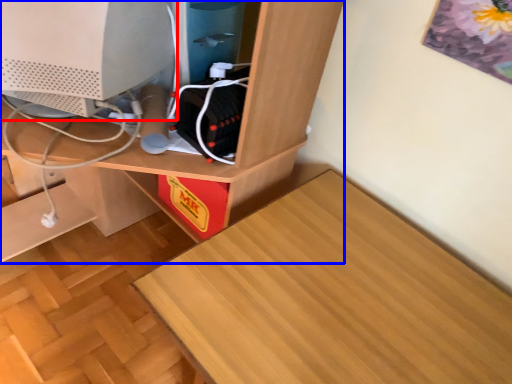
Question: Which object is closer to the camera taking this photo, computer monitor (highlighted by a red box) or desk (highlighted by a blue box)?

Choices:
 (A) computer monitor
 (B) desk

Answer: (B)